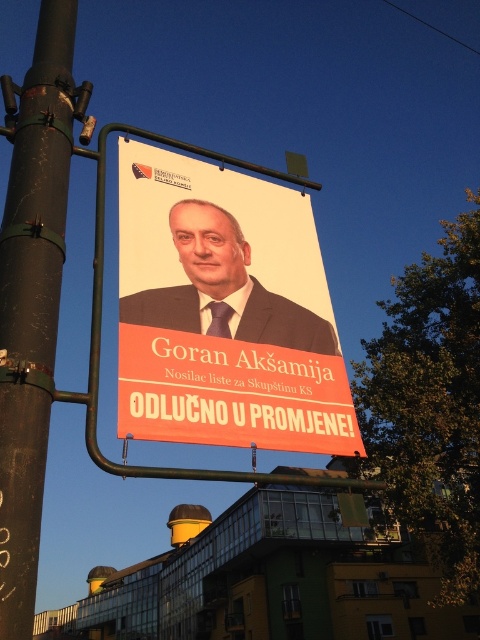
Can you confirm if matte black poster at center is shorter than green painted metal pole at left?

Correct, matte black poster at center is not as tall as green painted metal pole at left.

Can you confirm if matte black poster at center is positioned above green painted metal pole at left?

Incorrect, matte black poster at center is not positioned above green painted metal pole at left.

Based on the photo, measure the distance between point (330, 440) and camera.

Point (330, 440) and camera are 6.87 meters apart from each other.

Locate an element on the screen. Image resolution: width=480 pixels, height=640 pixels. matte black poster at center is located at coordinates (224, 310).

Based on the photo, who is more distant from viewer, (40, 141) or (326, 323)?

Positioned behind is point (326, 323).

In the scene shown: Is green painted metal pole at left to the left of matte black suit at center from the viewer's perspective?

Yes, green painted metal pole at left is to the left of matte black suit at center.

Is point (41, 13) positioned after point (133, 296)?

Yes, point (41, 13) is behind point (133, 296).

Locate an element on the screen. The image size is (480, 640). green painted metal pole at left is located at coordinates (32, 296).

Looking at this image, measure the distance between matte black poster at center and matte black suit at center.

The distance of matte black poster at center from matte black suit at center is 12.38 inches.

Measure the distance between matte black poster at center and camera.

matte black poster at center and camera are 5.74 meters apart from each other.

At what (x,y) coordinates should I click in order to perform the action: click on matte black poster at center. Please return your answer as a coordinate pair (x, y). Image resolution: width=480 pixels, height=640 pixels. Looking at the image, I should click on (224, 310).

Identify the location of matte black poster at center. This screenshot has width=480, height=640. (224, 310).